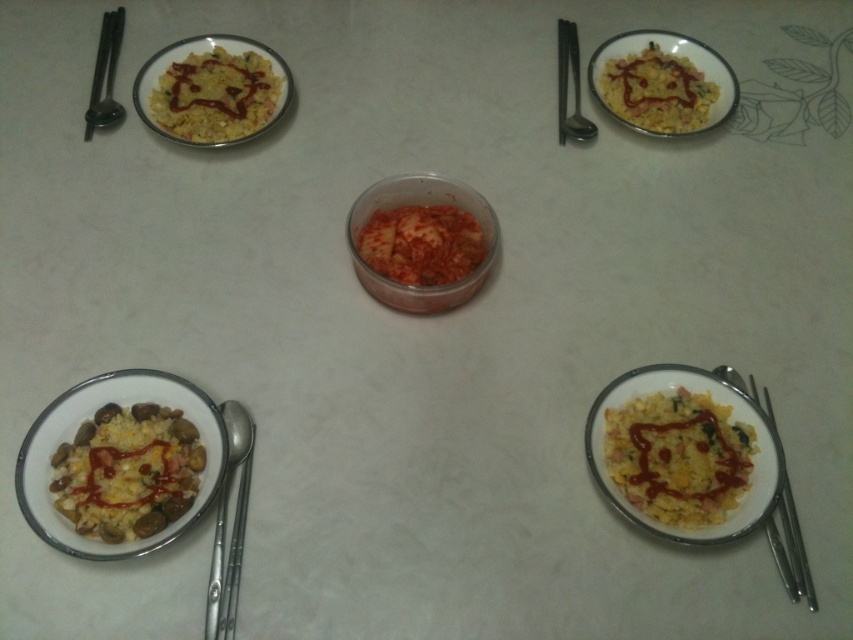
Question: Does silver metallic spoon at lower left have a lesser width compared to silver metallic chopsticks at upper left?

Choices:
 (A) no
 (B) yes

Answer: (B)

Question: Is silver chopsticks at bottom right positioned behind satin silver spoon at upper center?

Choices:
 (A) no
 (B) yes

Answer: (A)

Question: Is slightly translucent red kimchi at center smaller than silver metallic spoon at lower left?

Choices:
 (A) no
 (B) yes

Answer: (A)

Question: Among these objects, which one is nearest to the camera?

Choices:
 (A) silver metallic chopsticks at upper left
 (B) slightly translucent red kimchi at center
 (C) yellow rice at upper left

Answer: (B)

Question: Which object is the farthest from the satin silver spoon at upper center?

Choices:
 (A) translucent plastic container at center
 (B) yellow rice with mixed ingredients at bottom left

Answer: (B)

Question: Which is nearer to the satin silver spoon at upper center?

Choices:
 (A) translucent plastic container at center
 (B) yellow matte rice at upper right
 (C) slightly translucent red kimchi at center
 (D) silver chopsticks at bottom right

Answer: (B)